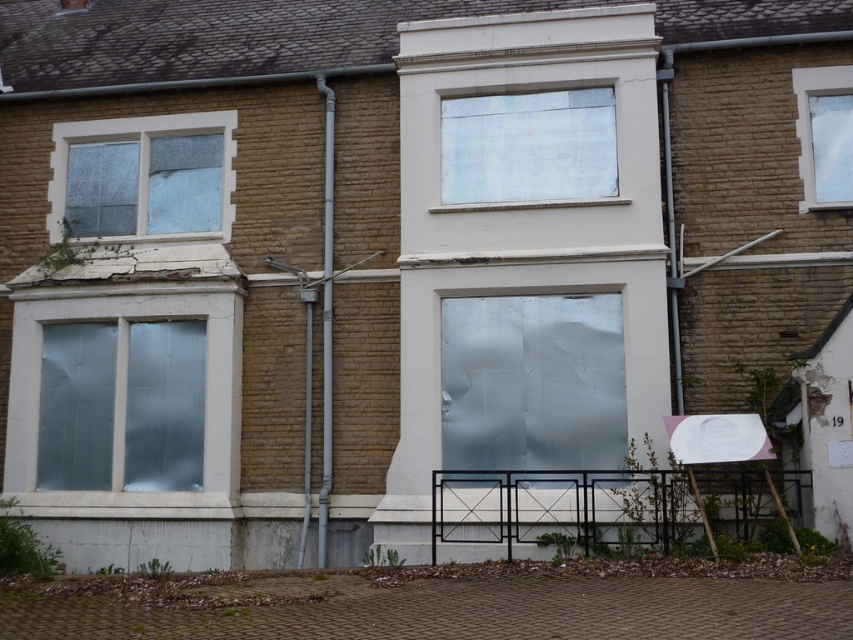
Question: Does frosted glass window at lower left have a larger size compared to transparent glass window at upper center?

Choices:
 (A) no
 (B) yes

Answer: (B)

Question: Is frosted glass window at center to the left of frosted glass window at lower left from the viewer's perspective?

Choices:
 (A) yes
 (B) no

Answer: (B)

Question: Among these points, which one is farthest from the camera?

Choices:
 (A) (148, 161)
 (B) (822, 204)
 (C) (440, 202)
 (D) (233, 328)

Answer: (A)

Question: Which of these objects is positioned closest to the transparent glass window at upper center?

Choices:
 (A) frosted glass window at center
 (B) frosted glass window at lower left
 (C) transparent glass window at upper left
 (D) clear glass window at upper right

Answer: (A)

Question: Which object appears closest to the camera in this image?

Choices:
 (A) frosted glass window at center
 (B) clear glass window at upper right

Answer: (A)

Question: Is frosted glass window at center to the left of transparent glass window at upper center from the viewer's perspective?

Choices:
 (A) no
 (B) yes

Answer: (B)